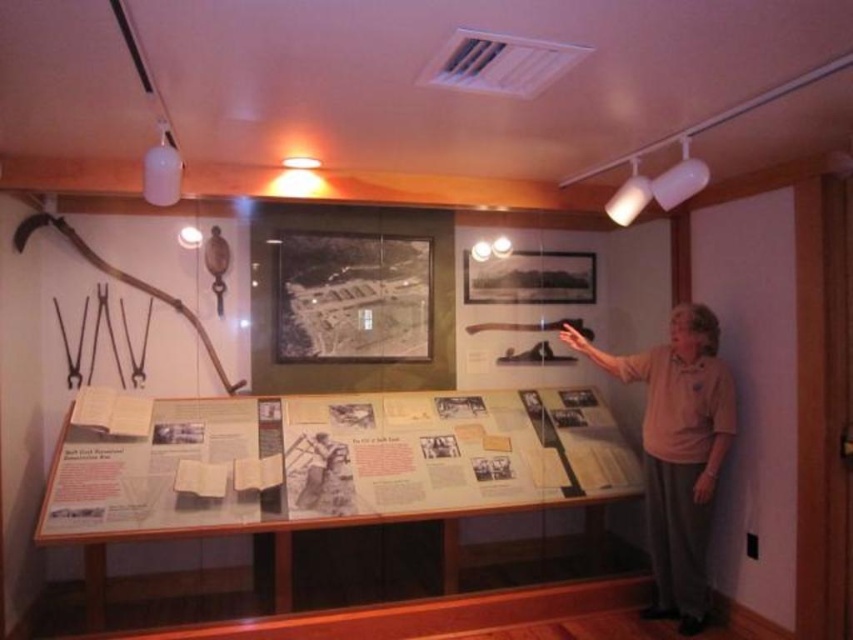
You are a visitor at the museum and see the pink cotton shirt at right and the white paper at center. Which object is placed on top of the other?

The pink cotton shirt at right is positioned over the white paper at center, so it is placed on top of the white paper at center.

You are a museum visitor who wants to take a photo of both the pink cotton shirt at right and the white paper at center. Since you want to include both in the frame, which object should you position closer to the camera to ensure both fit in the photo?

You should position the pink cotton shirt at right closer to the camera because its width is greater than the white paper at center. By moving the wider object closer, you can balance their apparent sizes in the photo, allowing both to fit within the frame.